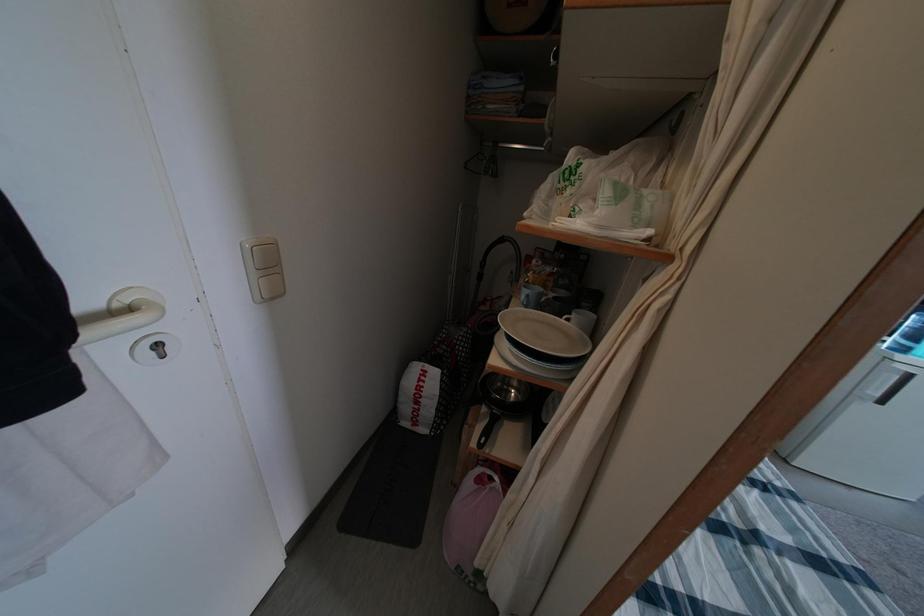
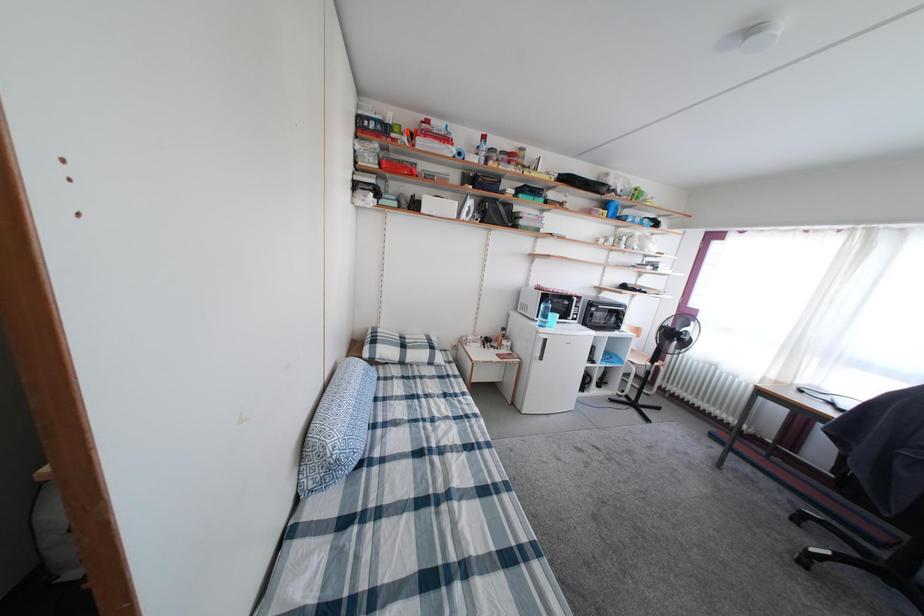
Question: Based on the continuous images, in which direction is the camera rotating? Reply with the corresponding letter.

Choices:
 (A) Left
 (B) Right
 (C) Up
 (D) Down

Answer: (B)